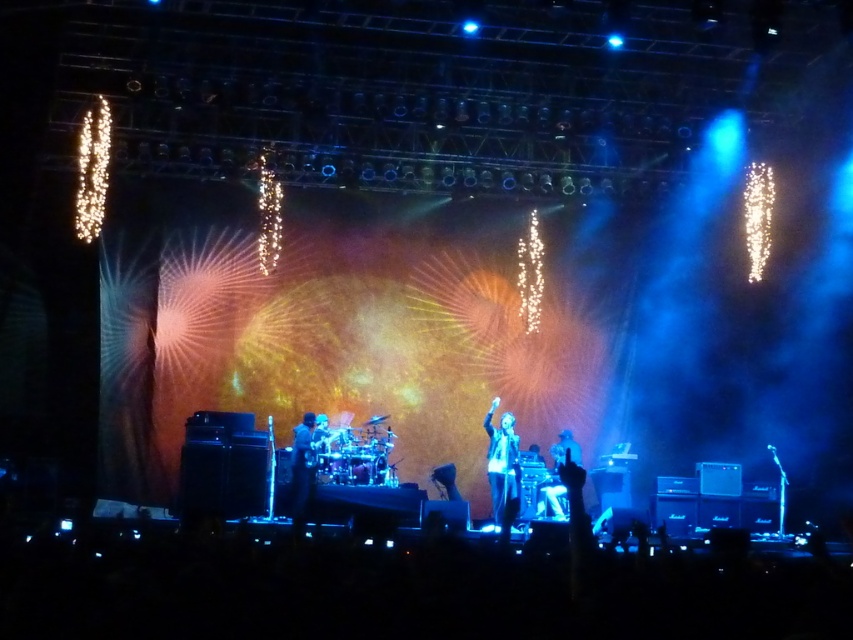
You are a stagehand who needs to adjust the microphone stand. You see the shiny black jacket at center and the shiny silver microphone at center. Which object is located higher in the image?

The shiny silver microphone at center is higher than the shiny black jacket at center because the shiny black jacket at center is positioned under the shiny silver microphone at center.

You are a photographer at the concert and want to capture a clear shot of both the shiny black jacket at center and the dark fabric jacket at center. Which jacket will appear larger in your photo?

The shiny black jacket at center will appear larger in the photo because it is closer to the viewer than the dark fabric jacket at center.